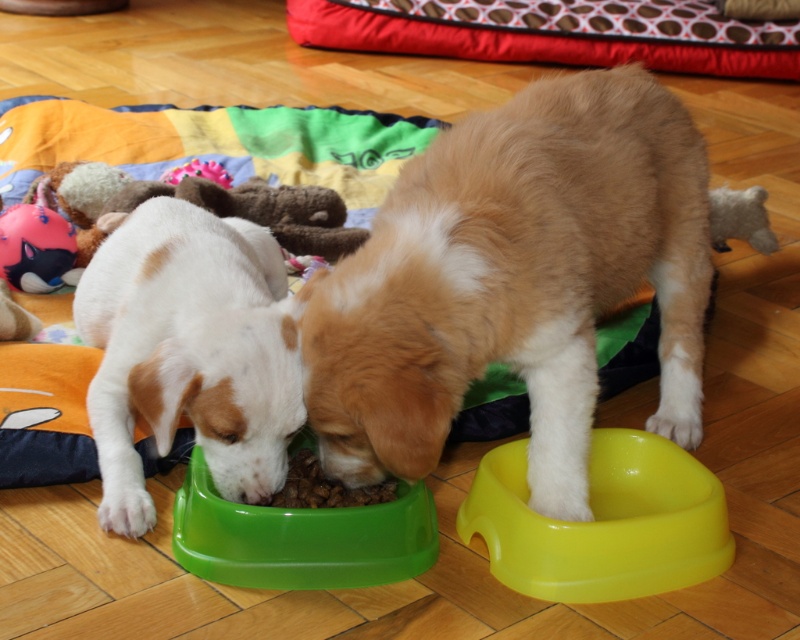
Who is lower down, golden fur dog at center or green plastic bowl at lower left?

green plastic bowl at lower left

What do you see at coordinates (516, 282) in the screenshot? The image size is (800, 640). I see `golden fur dog at center` at bounding box center [516, 282].

Locate an element on the screen. The image size is (800, 640). golden fur dog at center is located at coordinates (516, 282).

In order to click on white matte dog at lower left in this screenshot , I will do `click(189, 353)`.

Which is behind, point (193, 428) or point (668, 518)?

The point (193, 428) is more distant.

The width and height of the screenshot is (800, 640). I want to click on white matte dog at lower left, so click(189, 353).

Who is taller, golden fur dog at center or white matte dog at lower left?

golden fur dog at center

Which is more to the right, golden fur dog at center or white matte dog at lower left?

Positioned to the right is golden fur dog at center.

Image resolution: width=800 pixels, height=640 pixels. Identify the location of golden fur dog at center. (516, 282).

This screenshot has width=800, height=640. In order to click on golden fur dog at center in this screenshot , I will do `click(516, 282)`.